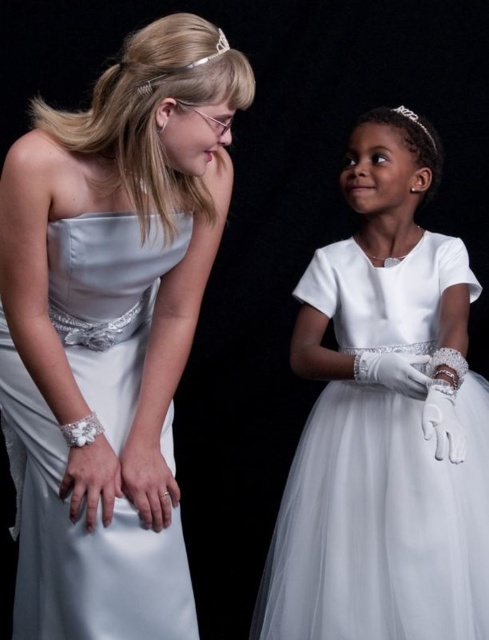
Between satin dress at center and white tulle dress at center, which one has less height?

white tulle dress at center

Which is below, satin dress at center or white tulle dress at center?

white tulle dress at center is below.

Image resolution: width=489 pixels, height=640 pixels. What do you see at coordinates (111, 332) in the screenshot?
I see `satin dress at center` at bounding box center [111, 332].

The width and height of the screenshot is (489, 640). Find the location of `satin dress at center`. satin dress at center is located at coordinates (111, 332).

Does satin dress at center have a greater height compared to clear crystal tiara at upper center?

Yes, satin dress at center is taller than clear crystal tiara at upper center.

Does satin dress at center appear over clear crystal tiara at upper center?

Actually, satin dress at center is below clear crystal tiara at upper center.

Does point (235, 100) lie behind point (225, 40)?

That is False.

Where is `satin dress at center`? satin dress at center is located at coordinates (111, 332).

How much distance is there between white tulle dress at center and silver metallic tiara at upper center?

white tulle dress at center and silver metallic tiara at upper center are 35.90 inches apart from each other.

Can you confirm if white tulle dress at center is shorter than silver metallic tiara at upper center?

In fact, white tulle dress at center may be taller than silver metallic tiara at upper center.

Measure the distance between point (363,557) and camera.

Point (363,557) and camera are 1.68 meters apart from each other.

At what (x,y) coordinates should I click in order to perform the action: click on white tulle dress at center. Please return your answer as a coordinate pair (x, y). The width and height of the screenshot is (489, 640). Looking at the image, I should click on (380, 525).